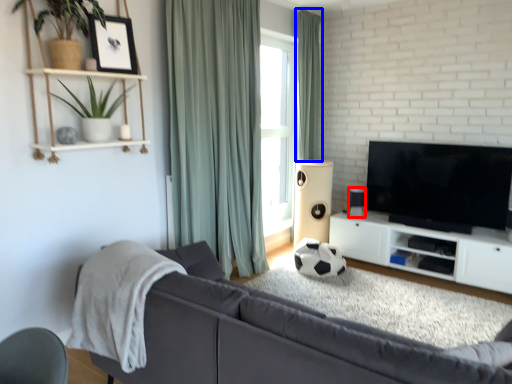
Question: Which object is further to the camera taking this photo, speaker (highlighted by a red box) or curtain (highlighted by a blue box)?

Choices:
 (A) speaker
 (B) curtain

Answer: (B)